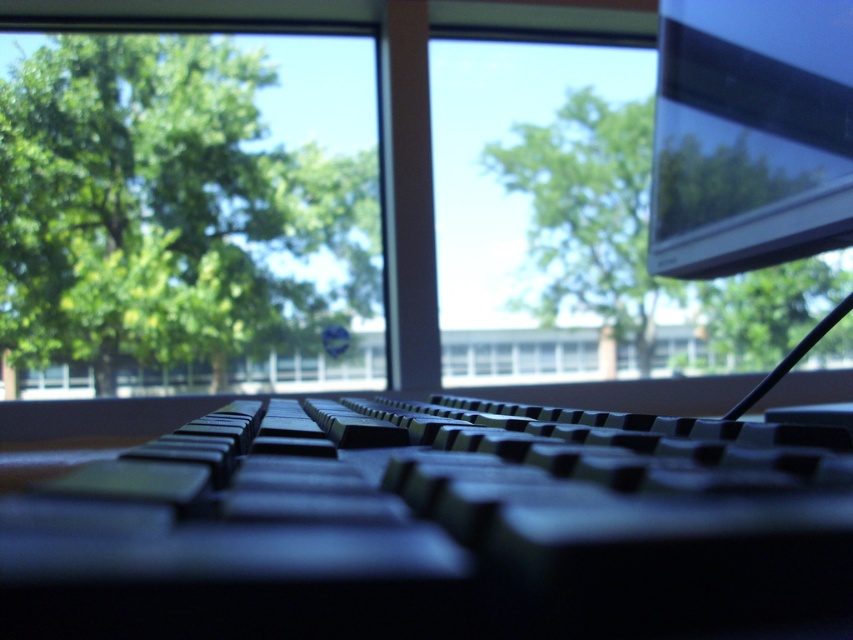
Question: Considering the real-world distances, which object is farthest from the matte black monitor at upper right?

Choices:
 (A) black plastic keyboard at center
 (B) green leafy tree at upper left

Answer: (B)

Question: Among these objects, which one is nearest to the camera?

Choices:
 (A) green leafy tree at upper center
 (B) matte black monitor at upper right

Answer: (B)

Question: Is black plastic keyboard at center further to the viewer compared to green leafy tree at upper center?

Choices:
 (A) no
 (B) yes

Answer: (A)

Question: Estimate the real-world distances between objects in this image. Which object is closer to the black plastic keyboard at center?

Choices:
 (A) green leafy tree at upper center
 (B) green leafy tree at upper left
 (C) matte black monitor at upper right

Answer: (C)

Question: Is green leafy tree at upper left bigger than green leafy tree at upper center?

Choices:
 (A) yes
 (B) no

Answer: (A)

Question: Is black plastic keyboard at center bigger than matte black monitor at upper right?

Choices:
 (A) no
 (B) yes

Answer: (A)